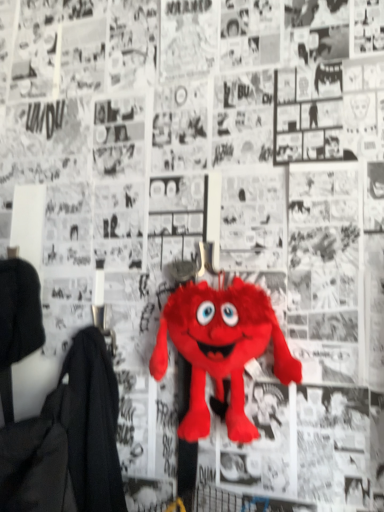
Question: Should I look upward or downward to see fluffy red plush toy at center?

Choices:
 (A) down
 (B) up

Answer: (A)